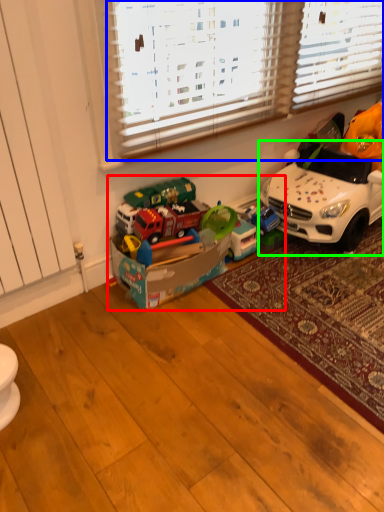
Question: Based on their relative distances, which object is farther from toy (highlighted by a red box)? Choose from blind (highlighted by a blue box) and car (highlighted by a green box).

Choices:
 (A) blind
 (B) car

Answer: (A)